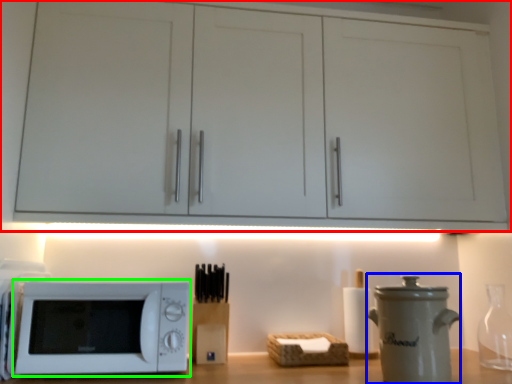
Question: Based on their relative distances, which object is farther from cabinetry (highlighted by a red box)? Choose from appliance (highlighted by a blue box) and microwave oven (highlighted by a green box).

Choices:
 (A) appliance
 (B) microwave oven

Answer: (A)